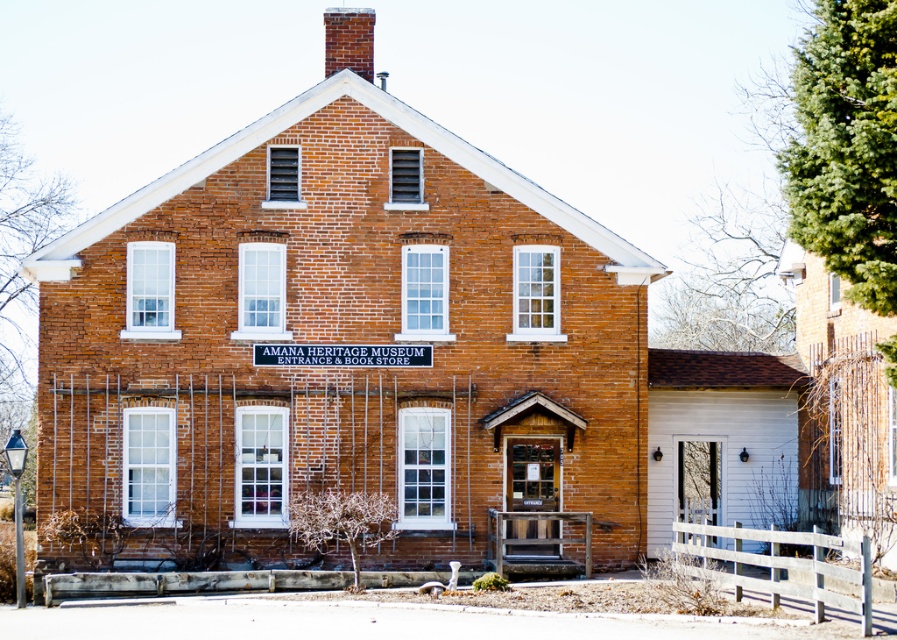
You are a maintenance worker who needs to inspect both the smooth brick chimney at center top and the red brick chimney at upper center. Given that your ladder can extend up to 25 feet, can you safely reach both chimneys without needing a taller ladder?

The distance between the smooth brick chimney at center top and the red brick chimney at upper center is 25.84 feet. Since your ladder can only extend to 25 feet, you cannot safely reach both chimneys without a taller ladder.

You are standing in front of the Amana Heritage Museum Entrance and Book Store. You notice two points marked on the building facade. One is at coordinate point (484, 500) and the other at point (337, 67). Which of these points is nearer to your current position?

Point (484, 500) is closer to the camera than point (337, 67), so the point at coordinate (484, 500) is nearer to your current position.

You are an architect examining the Amana Heritage Museum Entrance and Book Store. You notice two chimneys on the building. Which one is taller, the smooth brick chimney at center top or the red brick chimney at upper center?

The smooth brick chimney at center top is taller than the red brick chimney at upper center.